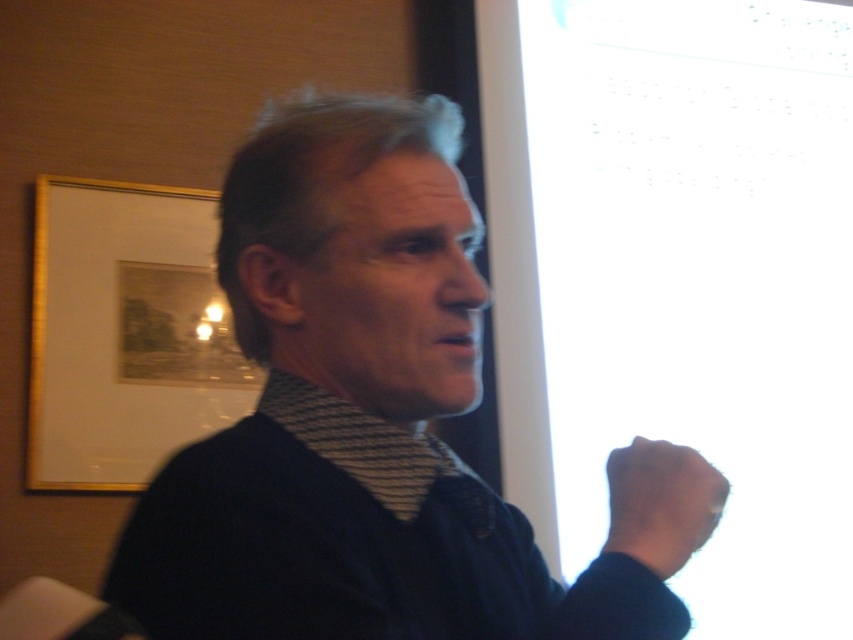
Question: Is gold framed picture at left in front of black matte hand at lower right?

Choices:
 (A) yes
 (B) no

Answer: (B)

Question: Is gold framed picture at left to the right of black matte hand at lower right from the viewer's perspective?

Choices:
 (A) yes
 (B) no

Answer: (B)

Question: Which object is the farthest from the gold framed picture at left?

Choices:
 (A) black matte hand at lower right
 (B) dark blue sweater at center

Answer: (A)

Question: Is dark blue sweater at center above gold framed picture at left?

Choices:
 (A) no
 (B) yes

Answer: (A)

Question: Which object is farther from the camera taking this photo?

Choices:
 (A) black matte hand at lower right
 (B) gold framed picture at left

Answer: (B)

Question: Which is farther from the dark blue sweater at center?

Choices:
 (A) gold framed picture at left
 (B) black matte hand at lower right

Answer: (A)